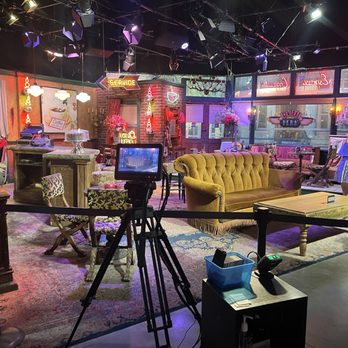
Where is `back of chair`? This screenshot has height=348, width=348. back of chair is located at coordinates (55, 186), (101, 201).